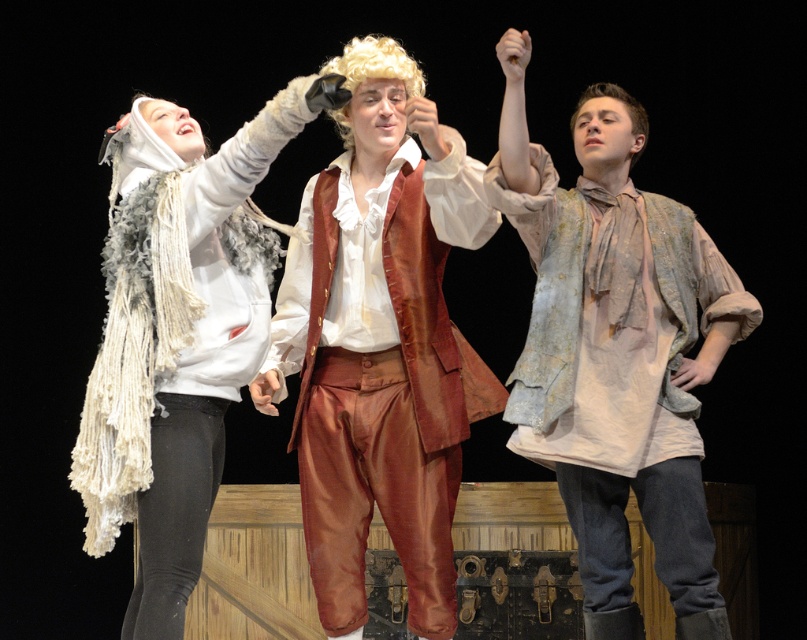
Question: Among these objects, which one is farthest from the camera?

Choices:
 (A) white fluffy scarf at upper left
 (B) distressed white shirt at center

Answer: (B)

Question: In this image, where is distressed white shirt at center located relative to white fluffy scarf at upper left?

Choices:
 (A) above
 (B) below

Answer: (A)

Question: Does distressed white shirt at center appear on the left side of white fluffy scarf at upper left?

Choices:
 (A) no
 (B) yes

Answer: (A)

Question: Based on their relative distances, which object is nearer to the satin brown vest at center?

Choices:
 (A) distressed white shirt at center
 (B) white fluffy scarf at upper left

Answer: (B)

Question: Which point is closer to the camera taking this photo?

Choices:
 (A) (92, 538)
 (B) (303, 465)

Answer: (A)

Question: Does satin brown vest at center appear on the left side of distressed white shirt at center?

Choices:
 (A) yes
 (B) no

Answer: (A)